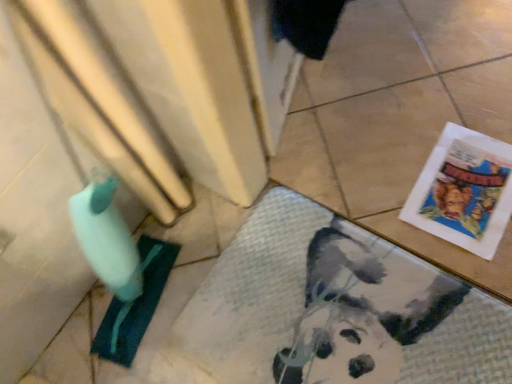
Question: From a real-world perspective, is white paper comic book at lower right above or below white textured bath mat at lower right?

Choices:
 (A) above
 (B) below

Answer: (A)

Question: Would you say white paper comic book at lower right is inside or outside white textured bath mat at lower right?

Choices:
 (A) outside
 (B) inside

Answer: (A)

Question: Does point (441, 221) appear closer or farther from the camera than point (435, 360)?

Choices:
 (A) farther
 (B) closer

Answer: (A)

Question: Is white textured bath mat at lower right bigger or smaller than white paper comic book at lower right?

Choices:
 (A) big
 (B) small

Answer: (A)

Question: Considering the relative positions of white textured bath mat at lower right and white paper comic book at lower right in the image provided, is white textured bath mat at lower right to the left or to the right of white paper comic book at lower right?

Choices:
 (A) left
 (B) right

Answer: (A)

Question: From a real-world perspective, is white textured bath mat at lower right physically located above or below white paper comic book at lower right?

Choices:
 (A) below
 (B) above

Answer: (A)

Question: Looking at their shapes, would you say white textured bath mat at lower right is wider or thinner than white paper comic book at lower right?

Choices:
 (A) wide
 (B) thin

Answer: (A)